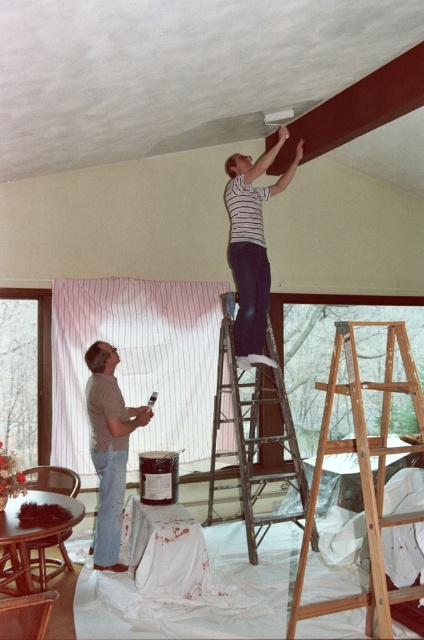
Between metallic silver ladder at center and striped fabric at upper center, which one appears on the right side from the viewer's perspective?

Positioned to the right is striped fabric at upper center.

Who is shorter, metallic silver ladder at center or striped fabric at upper center?

striped fabric at upper center is shorter.

Between point (239, 500) and point (225, 163), which one is positioned in front?

Point (225, 163)

I want to click on metallic silver ladder at center, so click(x=253, y=435).

Does wooden ladder at center have a lesser width compared to metallic silver ladder at center?

Correct, wooden ladder at center's width is less than metallic silver ladder at center's.

Is point (371, 620) less distant than point (261, 413)?

Yes.

The height and width of the screenshot is (640, 424). In order to click on wooden ladder at center in this screenshot , I will do `click(363, 474)`.

Can you confirm if wooden ladder at center is thinner than gray matte shirt at lower left?

Incorrect, wooden ladder at center's width is not less than gray matte shirt at lower left's.

Who is shorter, wooden ladder at center or gray matte shirt at lower left?

Standing shorter between the two is gray matte shirt at lower left.

This screenshot has width=424, height=640. Identify the location of wooden ladder at center. (363, 474).

Where is `wooden ladder at center`? Image resolution: width=424 pixels, height=640 pixels. wooden ladder at center is located at coordinates (363, 474).